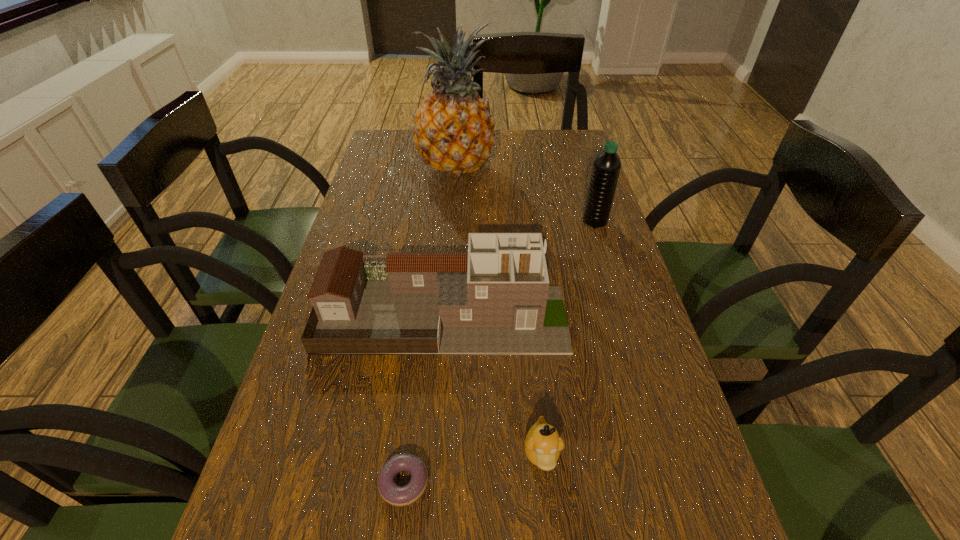
This screenshot has height=540, width=960. What are the coordinates of `the tallest object` in the screenshot? It's located at (453, 130).

Identify the location of pineapple. The height and width of the screenshot is (540, 960). (453, 130).

I want to click on the second farthest object, so click(x=606, y=168).

Locate an element on the screen. The width and height of the screenshot is (960, 540). the second tallest object is located at coordinates (606, 168).

The width and height of the screenshot is (960, 540). In order to click on dollhouse in this screenshot , I will do `click(495, 299)`.

You are a GUI agent. You are given a task and a screenshot of the screen. Output one action in this format:
    pyautogui.click(x=<x>, y=<y>)
    Task: Click on the third shortest object
    
    Given the screenshot: What is the action you would take?
    pyautogui.click(x=495, y=299)

Where is `duckling`? Image resolution: width=960 pixels, height=540 pixels. duckling is located at coordinates (543, 444).

Identify the location of doughnut. (395, 495).

Where is `vacant space located on the left of the pineapple`? This screenshot has height=540, width=960. vacant space located on the left of the pineapple is located at coordinates (367, 166).

You are a GUI agent. You are given a task and a screenshot of the screen. Output one action in this format:
    pyautogui.click(x=<x>, y=<y>)
    Task: Click on the vacant region located 0.210m on the back of the fourth nearest object
    
    Given the screenshot: What is the action you would take?
    pyautogui.click(x=581, y=176)